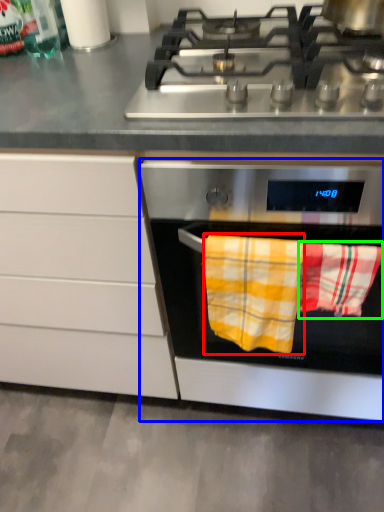
Question: Which object is positioned closest to beach towel (highlighted by a red box)? Select from oven (highlighted by a blue box) and beach towel (highlighted by a green box).

Choices:
 (A) oven
 (B) beach towel

Answer: (B)